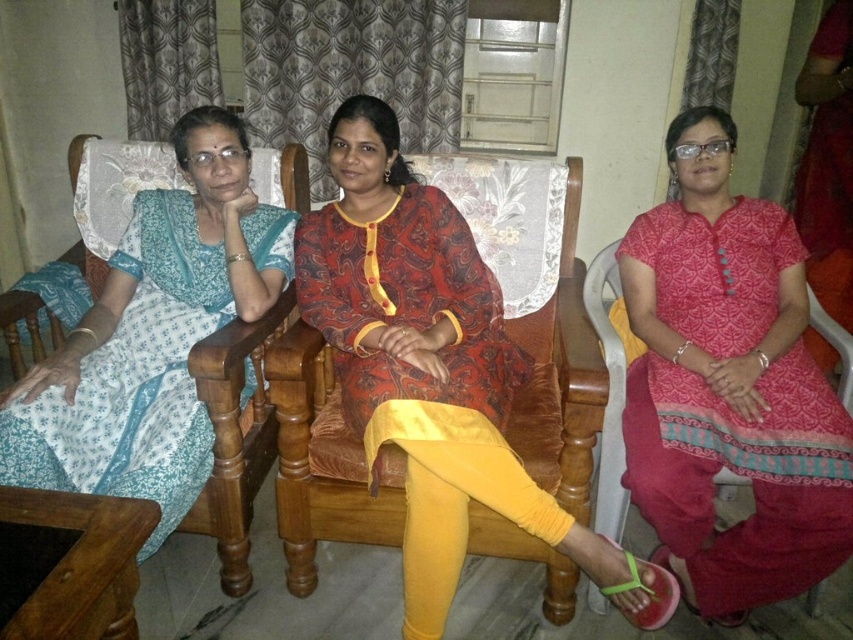
Does matte red dress at center appear under light blue printed dress at left?

Yes.

Does matte red dress at center have a smaller size compared to light blue printed dress at left?

No, matte red dress at center is not smaller than light blue printed dress at left.

Is point (364, 148) positioned after point (231, 316)?

No, (364, 148) is closer to viewer.

Locate an element on the screen. matte red dress at center is located at coordinates (430, 368).

Does matte pink dress at center appear over matte red dress at center?

Yes, matte pink dress at center is above matte red dress at center.

Which is below, matte pink dress at center or matte red dress at center?

matte red dress at center is lower down.

Is point (637, 424) in front of point (579, 525)?

No, it is not.

You are a GUI agent. You are given a task and a screenshot of the screen. Output one action in this format:
    pyautogui.click(x=<x>, y=<y>)
    Task: Click on the matte pink dress at center
    This screenshot has width=853, height=640.
    Given the screenshot: What is the action you would take?
    pyautogui.click(x=729, y=387)

Does matte pink dress at center appear under light blue printed dress at left?

Yes.

Can you confirm if matte pink dress at center is wider than light blue printed dress at left?

In fact, matte pink dress at center might be narrower than light blue printed dress at left.

Where is `matte pink dress at center`? matte pink dress at center is located at coordinates (729, 387).

Locate an element on the screen. The width and height of the screenshot is (853, 640). matte pink dress at center is located at coordinates (729, 387).